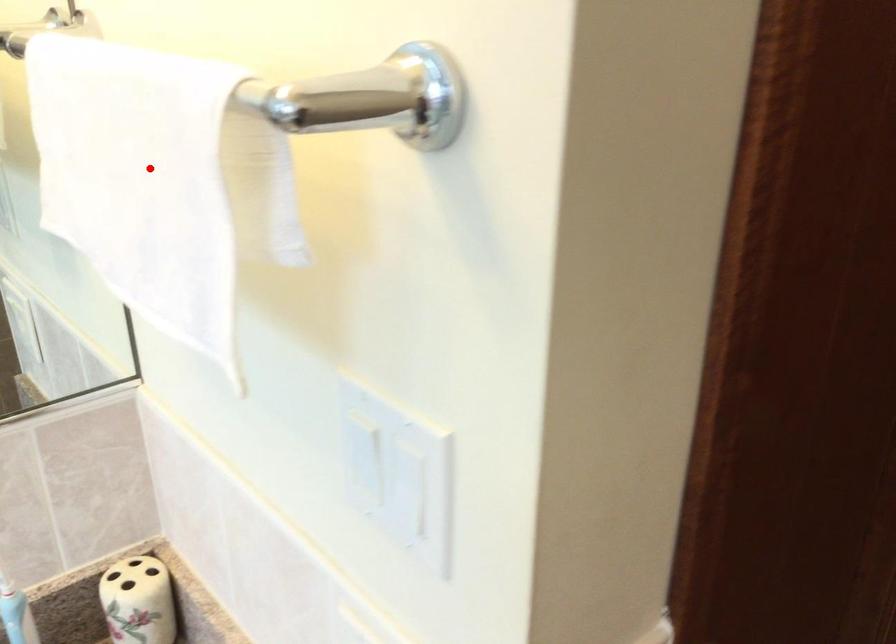
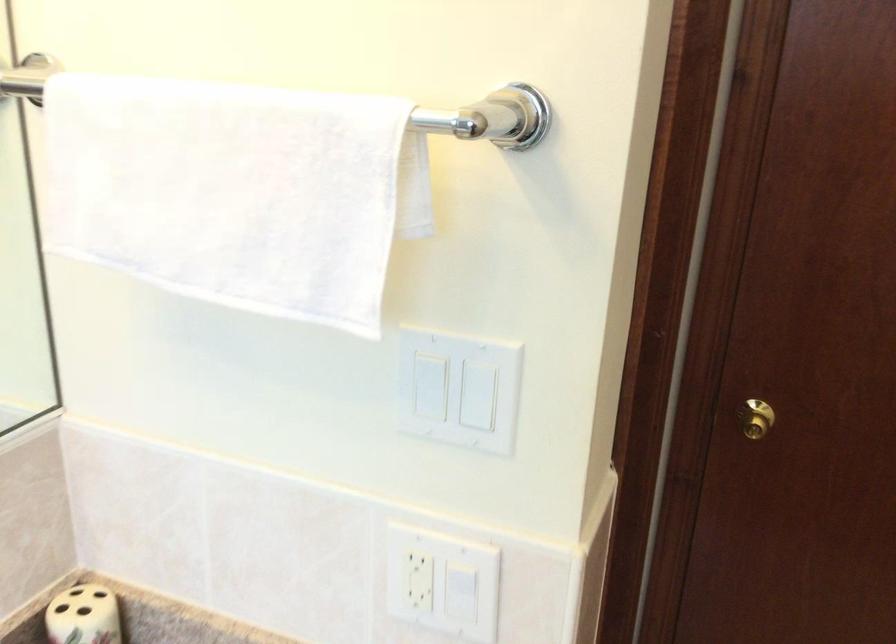
Find the pixel in the second image that matches the highlighted location in the first image.

(229, 191)